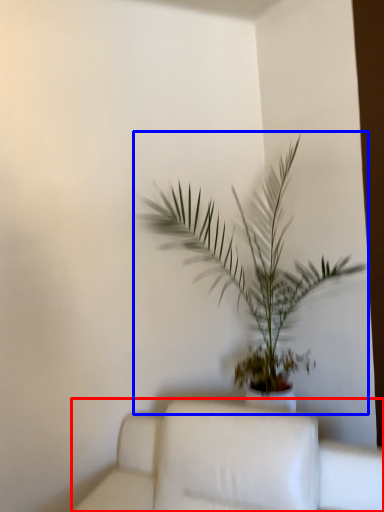
Question: Which object is further to the camera taking this photo, furniture (highlighted by a red box) or houseplant (highlighted by a blue box)?

Choices:
 (A) furniture
 (B) houseplant

Answer: (B)